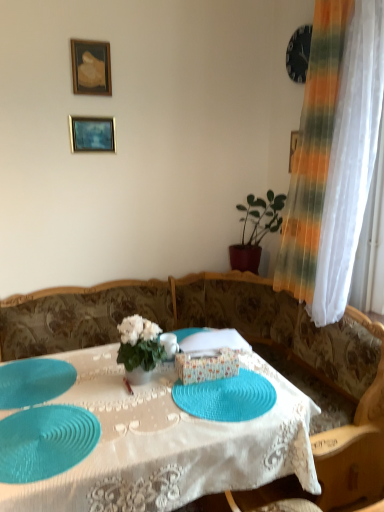
Describe the element at coordinates (45, 442) in the screenshot. I see `teal rubber placemat at lower left, positioned as the 2th glass plate in left-to-right order` at that location.

Where is `teal rubber placemat at center`? teal rubber placemat at center is located at coordinates (168, 444).

This screenshot has width=384, height=512. What do you see at coordinates (168, 444) in the screenshot?
I see `teal rubber placemat at center` at bounding box center [168, 444].

The width and height of the screenshot is (384, 512). What are the coordinates of `green matte plant at right` in the screenshot? It's located at (256, 230).

At what (x,y) coordinates should I click in order to perform the action: click on teal rubber placemat at lower left, positioned as the 2th glass plate in left-to-right order. Please return your answer as a coordinate pair (x, y). The height and width of the screenshot is (512, 384). Looking at the image, I should click on (45, 442).

From the image's perspective, is teal rubber placemat at lower left, positioned as the 2th glass plate in left-to-right order, under teal rubber placemat at lower left, positioned as the 1th glass plate in left-to-right order?

Correct, teal rubber placemat at lower left, positioned as the 2th glass plate in left-to-right order, appears lower than teal rubber placemat at lower left, positioned as the 1th glass plate in left-to-right order, in the image.

Is teal rubber placemat at lower left, positioned as the 2th glass plate in left-to-right order, situated inside teal rubber placemat at lower left, positioned as the 1th glass plate in left-to-right order, or outside?

teal rubber placemat at lower left, positioned as the 2th glass plate in left-to-right order, is located beyond the bounds of teal rubber placemat at lower left, positioned as the 1th glass plate in left-to-right order.

Can you tell me how much teal rubber placemat at lower left, positioned as the 2th glass plate in left-to-right order, and teal rubber placemat at lower left, acting as the third glass plate starting from the right, differ in facing direction?

The angular difference between teal rubber placemat at lower left, positioned as the 2th glass plate in left-to-right order, and teal rubber placemat at lower left, acting as the third glass plate starting from the right, is 2.62 degrees.

Identify the location of glass plate beneath the teal rubber placemat at lower left, acting as the third glass plate starting from the right (from a real-world perspective). (45, 442).

In the image, is green matte plant at right positioned in front of or behind gold-framed painting at upper left, which is the 2th picture frame from bottom to top?

Clearly, green matte plant at right is behind gold-framed painting at upper left, which is the 2th picture frame from bottom to top.

Is point (238, 246) farther from camera compared to point (80, 46)?

Yes, point (238, 246) is behind point (80, 46).

The width and height of the screenshot is (384, 512). In order to click on the 1st picture frame to the left of the green matte plant at right, starting your count from the anchor in this screenshot , I will do (x=91, y=67).

From the image's perspective, which object appears higher, green matte plant at right or white fabric flower at center?

green matte plant at right appears higher in the image.

Between green matte plant at right and white fabric flower at center, which one has larger size?

green matte plant at right is bigger.

The width and height of the screenshot is (384, 512). I want to click on houseplant behind the white fabric flower at center, so click(x=256, y=230).

Based on their positions, is teal rubber placemat at center located to the left or right of teal woven placemat at center, which ranks as the first glass plate in right-to-left order?

teal rubber placemat at center is positioned on teal woven placemat at center, which ranks as the first glass plate in right-to-left order,'s left side.

What's the angular difference between teal rubber placemat at center and teal woven placemat at center, the 3th glass plate positioned from the left,'s facing directions?

The angle between the facing direction of teal rubber placemat at center and the facing direction of teal woven placemat at center, the 3th glass plate positioned from the left, is 88.1 degrees.

Could you tell me if teal rubber placemat at center is facing teal woven placemat at center, the 3th glass plate positioned from the left?

No, teal rubber placemat at center is not oriented towards teal woven placemat at center, the 3th glass plate positioned from the left.

Is teal rubber placemat at center spatially inside teal woven placemat at center, the 3th glass plate positioned from the left, or outside of it?

teal rubber placemat at center lies outside teal woven placemat at center, the 3th glass plate positioned from the left.

From the image's perspective, is teal rubber placemat at lower left, positioned as the 2th glass plate in left-to-right order, located above or below matte gold picture frame at upper left, marked as the 2th picture frame in a top-to-bottom arrangement?

Clearly, from the image's perspective, teal rubber placemat at lower left, positioned as the 2th glass plate in left-to-right order, is below matte gold picture frame at upper left, marked as the 2th picture frame in a top-to-bottom arrangement.

Are teal rubber placemat at lower left, positioned as the 2th glass plate in left-to-right order, and matte gold picture frame at upper left, marked as the 2th picture frame in a top-to-bottom arrangement, making contact?

No, teal rubber placemat at lower left, positioned as the 2th glass plate in left-to-right order, is not making contact with matte gold picture frame at upper left, marked as the 2th picture frame in a top-to-bottom arrangement.

Looking at their sizes, would you say teal rubber placemat at lower left, the second glass plate in the right-to-left sequence, is wider or thinner than matte gold picture frame at upper left, placed as the 1th picture frame when sorted from bottom to top?

Clearly, teal rubber placemat at lower left, the second glass plate in the right-to-left sequence, has more width compared to matte gold picture frame at upper left, placed as the 1th picture frame when sorted from bottom to top.

Which is in front, point (48, 431) or point (86, 133)?

Point (48, 431)

Could you measure the distance between teal woven placemat at center, the 3th glass plate positioned from the left, and teal rubber placemat at center?

6.28 inches.

Considering the points (267, 384) and (167, 416), which point is behind, point (267, 384) or point (167, 416)?

The point (267, 384) is behind.

Does teal woven placemat at center, which ranks as the first glass plate in right-to-left order, have a larger size compared to teal rubber placemat at center?

No.

Can you tell me how much teal woven placemat at center, which ranks as the first glass plate in right-to-left order, and teal rubber placemat at center differ in facing direction?

teal woven placemat at center, which ranks as the first glass plate in right-to-left order, and teal rubber placemat at center are facing 88.1 degrees away from each other.

Is teal rubber placemat at lower left, the second glass plate in the right-to-left sequence, positioned with its back to teal woven placemat at center, the 3th glass plate positioned from the left?

Correct, teal rubber placemat at lower left, the second glass plate in the right-to-left sequence, is looking away from teal woven placemat at center, the 3th glass plate positioned from the left.

Is teal rubber placemat at lower left, the second glass plate in the right-to-left sequence, in front of or behind teal woven placemat at center, which ranks as the first glass plate in right-to-left order, in the image?

teal rubber placemat at lower left, the second glass plate in the right-to-left sequence, is in front of teal woven placemat at center, which ranks as the first glass plate in right-to-left order.

From a real-world perspective, is teal rubber placemat at lower left, the second glass plate in the right-to-left sequence, on top of teal woven placemat at center, which ranks as the first glass plate in right-to-left order?

No.

Locate an element on the screen. Image resolution: width=384 pixels, height=512 pixels. glass plate that is the 2nd object above the teal rubber placemat at lower left, the second glass plate in the right-to-left sequence (from a real-world perspective) is located at coordinates (226, 397).

Where is `glass plate on the left of teal rubber placemat at lower left, positioned as the 2th glass plate in left-to-right order`? glass plate on the left of teal rubber placemat at lower left, positioned as the 2th glass plate in left-to-right order is located at coordinates (34, 381).

This screenshot has width=384, height=512. Find the location of `houseplant below the gold-framed painting at upper left, which is the 2th picture frame from bottom to top (from a real-world perspective)`. houseplant below the gold-framed painting at upper left, which is the 2th picture frame from bottom to top (from a real-world perspective) is located at coordinates (256, 230).

Considering their positions, is gold-framed painting at upper left, arranged as the first picture frame when viewed from the top, positioned closer to teal rubber placemat at center than teal woven placemat at center, which ranks as the first glass plate in right-to-left order?

Based on the image, teal woven placemat at center, which ranks as the first glass plate in right-to-left order, appears to be nearer to teal rubber placemat at center.

Considering their positions, is teal rubber placemat at lower left, the second glass plate in the right-to-left sequence, positioned closer to matte gold picture frame at upper left, marked as the 2th picture frame in a top-to-bottom arrangement, than teal rubber placemat at center?

teal rubber placemat at center.

Based on their spatial positions, is teal rubber placemat at center or matte gold picture frame at upper left, placed as the 1th picture frame when sorted from bottom to top, further from teal woven placemat at center, which ranks as the first glass plate in right-to-left order?

matte gold picture frame at upper left, placed as the 1th picture frame when sorted from bottom to top, is further to teal woven placemat at center, which ranks as the first glass plate in right-to-left order.

Based on their spatial positions, is teal rubber placemat at lower left, acting as the third glass plate starting from the right, or teal woven placemat at center, the 3th glass plate positioned from the left, further from green matte plant at right?

Among the two, teal rubber placemat at lower left, acting as the third glass plate starting from the right, is located further to green matte plant at right.

Which object lies further to the anchor point teal woven placemat at center, the 3th glass plate positioned from the left, matte gold picture frame at upper left, marked as the 2th picture frame in a top-to-bottom arrangement, or white fabric flower at center?

Based on the image, matte gold picture frame at upper left, marked as the 2th picture frame in a top-to-bottom arrangement, appears to be further to teal woven placemat at center, the 3th glass plate positioned from the left.

Looking at the image, which one is located closer to teal rubber placemat at lower left, positioned as the 2th glass plate in left-to-right order, matte gold picture frame at upper left, marked as the 2th picture frame in a top-to-bottom arrangement, or teal rubber placemat at lower left, acting as the third glass plate starting from the right?

The object closer to teal rubber placemat at lower left, positioned as the 2th glass plate in left-to-right order, is teal rubber placemat at lower left, acting as the third glass plate starting from the right.

Based on their spatial positions, is teal rubber placemat at center or teal rubber placemat at lower left, positioned as the 1th glass plate in left-to-right order, further from matte gold picture frame at upper left, marked as the 2th picture frame in a top-to-bottom arrangement?

teal rubber placemat at center lies further to matte gold picture frame at upper left, marked as the 2th picture frame in a top-to-bottom arrangement, than the other object.

Which object lies nearer to the anchor point gold-framed painting at upper left, arranged as the first picture frame when viewed from the top, white fabric flower at center or teal rubber placemat at lower left, the second glass plate in the right-to-left sequence?

white fabric flower at center.

Locate an element on the screen. The width and height of the screenshot is (384, 512). glass plate between teal rubber placemat at lower left, positioned as the 1th glass plate in left-to-right order, and white fabric flower at center from left to right is located at coordinates (45, 442).

Locate an element on the screen. The image size is (384, 512). glass plate between teal woven placemat at center, which ranks as the first glass plate in right-to-left order, and green matte plant at right, along the z-axis is located at coordinates (34, 381).

Where is `floral arrangement between gold-framed painting at upper left, arranged as the first picture frame when viewed from the top, and teal rubber placemat at lower left, positioned as the 2th glass plate in left-to-right order, in the up-down direction`? The width and height of the screenshot is (384, 512). floral arrangement between gold-framed painting at upper left, arranged as the first picture frame when viewed from the top, and teal rubber placemat at lower left, positioned as the 2th glass plate in left-to-right order, in the up-down direction is located at coordinates (140, 344).

The width and height of the screenshot is (384, 512). Identify the location of floral arrangement between teal rubber placemat at lower left, positioned as the 1th glass plate in left-to-right order, and green matte plant at right. (140, 344).